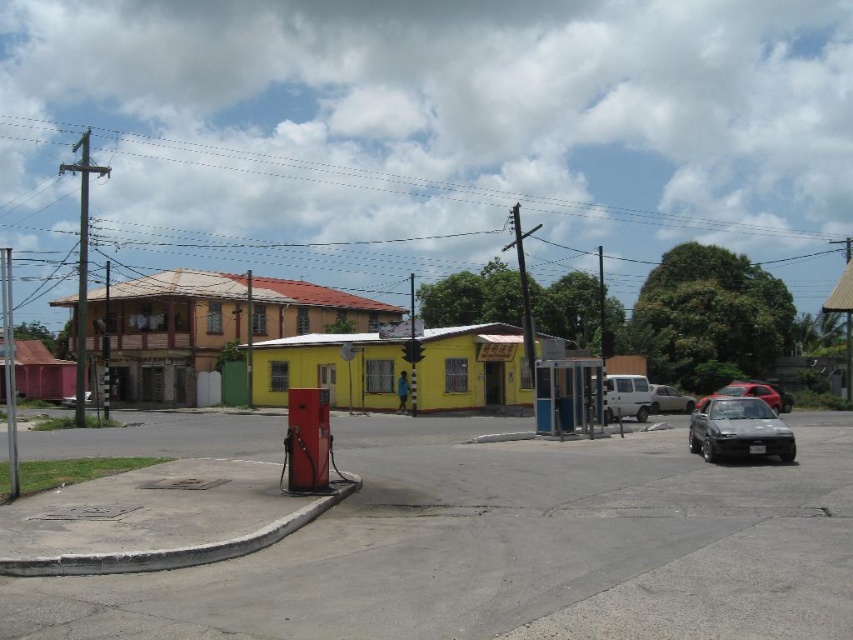
You are driving a shiny black car at right and want to park it near the red fuel pump. Based on the coordinates provided in the scene description, can you determine if the car will fit in the parking space adjacent to the fuel pump?

The shiny black car at right is located at point (738, 429). Since the coordinates indicate its position relative to the fuel pump, the car should fit in the parking space adjacent to the fuel pump as long as the space dimensions accommodate its size.

You are a delivery person trying to park your 1.8 meter wide van between the shiny black car at right and the metallic silver car at right. Can you fit your van in the space between them?

The shiny black car at right is thinner than the metallic silver car at right, so the space between them might be sufficient for your 1.8 meter wide van. However, the exact width isn